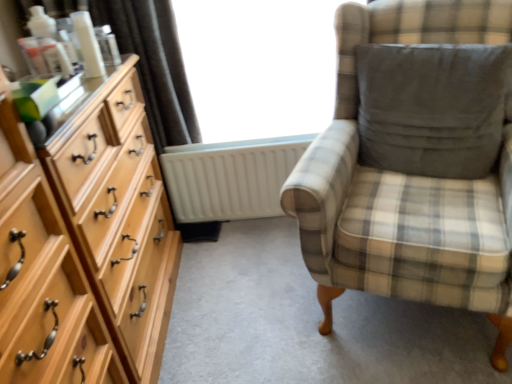
Find the location of `free space above dark gray fabric pillow at right (from a real-world perspective)`. free space above dark gray fabric pillow at right (from a real-world perspective) is located at coordinates (432, 52).